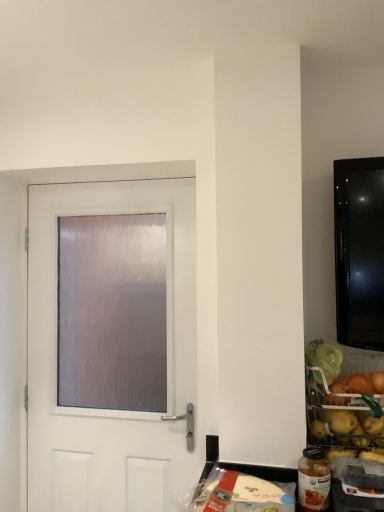
Question: Is golden potatoes at right, arranged as the 2th food when viewed from the left, located outside white matte door at center?

Choices:
 (A) no
 (B) yes

Answer: (B)

Question: Is golden potatoes at right, arranged as the 2th food when viewed from the left, oriented towards white matte door at center?

Choices:
 (A) no
 (B) yes

Answer: (A)

Question: Is golden potatoes at right, which is the second food from bottom to top, bigger than white matte door at center?

Choices:
 (A) yes
 (B) no

Answer: (A)

Question: Does golden potatoes at right, arranged as the 2th food when viewed from the left, lie in front of white matte door at center?

Choices:
 (A) no
 (B) yes

Answer: (B)

Question: From the image's perspective, would you say golden potatoes at right, arranged as the 2th food when viewed from the left, is positioned over white matte door at center?

Choices:
 (A) yes
 (B) no

Answer: (B)

Question: From a real-world perspective, is golden potatoes at right, the 1th food from the right, physically located above or below white matte door at center?

Choices:
 (A) below
 (B) above

Answer: (A)

Question: In terms of height, does golden potatoes at right, which is the second food from bottom to top, look taller or shorter compared to white matte door at center?

Choices:
 (A) tall
 (B) short

Answer: (B)

Question: From the image's perspective, is golden potatoes at right, arranged as the 2th food when viewed from the left, above or below white matte door at center?

Choices:
 (A) below
 (B) above

Answer: (A)

Question: In the image, is golden potatoes at right, which is the second food from bottom to top, positioned in front of or behind white matte door at center?

Choices:
 (A) front
 (B) behind

Answer: (A)

Question: From a real-world perspective, is white matte door at center positioned above or below translucent plastic bag at lower center, which is the 2th food in right-to-left order?

Choices:
 (A) below
 (B) above

Answer: (B)

Question: Considering the positions of point (168, 234) and point (210, 498), is point (168, 234) closer or farther from the camera than point (210, 498)?

Choices:
 (A) closer
 (B) farther

Answer: (B)

Question: From the image's perspective, relative to translucent plastic bag at lower center, arranged as the second food when viewed from the top, is white matte door at center above or below?

Choices:
 (A) above
 (B) below

Answer: (A)

Question: Is white matte door at center inside the boundaries of translucent plastic bag at lower center, arranged as the second food when viewed from the top, or outside?

Choices:
 (A) outside
 (B) inside

Answer: (A)

Question: From their relative heights in the image, would you say translucent plastic bag at lower center, the first food positioned from the left, is taller or shorter than golden potatoes at right, the 1th food from the right?

Choices:
 (A) short
 (B) tall

Answer: (A)

Question: From a real-world perspective, is translucent plastic bag at lower center, the first food positioned from the left, positioned above or below golden potatoes at right, which is the second food from bottom to top?

Choices:
 (A) above
 (B) below

Answer: (B)